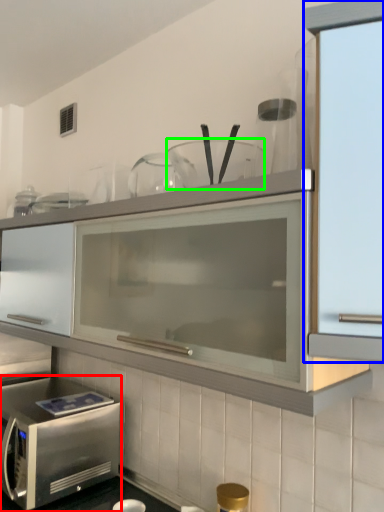
Question: Considering the real-world distances, which object is closest to microwave oven (highlighted by a red box)? cabinetry (highlighted by a blue box) or tableware (highlighted by a green box).

Choices:
 (A) cabinetry
 (B) tableware

Answer: (B)